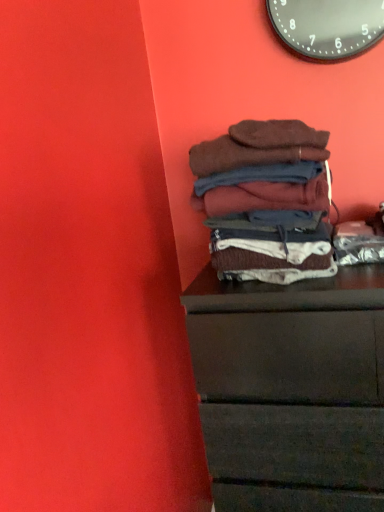
Question: In the image, is dark wood chest of drawers at lower right positioned in front of or behind brown soft fabric at center?

Choices:
 (A) front
 (B) behind

Answer: (A)

Question: Based on their sizes in the image, would you say dark wood chest of drawers at lower right is bigger or smaller than brown soft fabric at center?

Choices:
 (A) small
 (B) big

Answer: (B)

Question: Estimate the real-world distances between objects in this image. Which object is farther from the dark wood chest of drawers at lower right?

Choices:
 (A) black metallic clock at upper center
 (B) brown soft fabric at center

Answer: (A)

Question: Based on their relative distances, which object is farther from the black metallic clock at upper center?

Choices:
 (A) dark wood chest of drawers at lower right
 (B) brown soft fabric at center

Answer: (A)